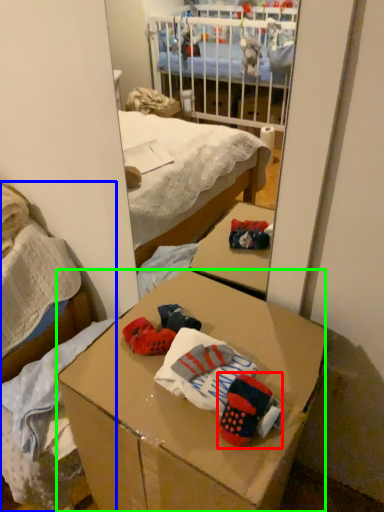
Question: Estimate the real-world distances between objects in this image. Which object is closer to toy (highlighted by a red box), bed (highlighted by a blue box) or desk (highlighted by a green box)?

Choices:
 (A) bed
 (B) desk

Answer: (B)